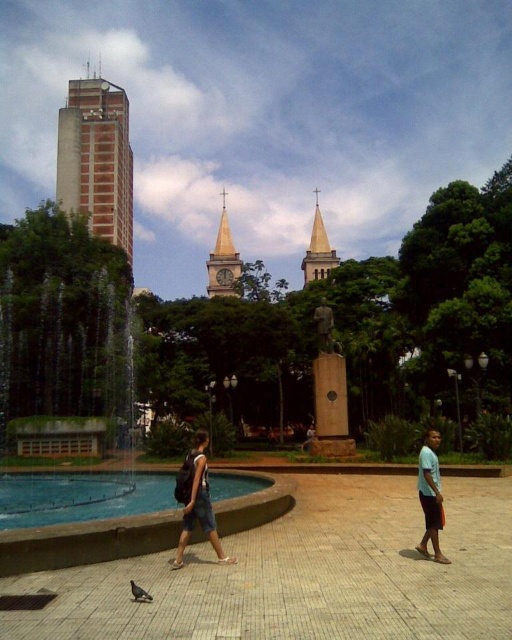
Which of these two, smooth stone clock tower at center or smooth stone spire at center, stands shorter?

Standing shorter between the two is smooth stone spire at center.

Between smooth stone clock tower at center and smooth stone spire at center, which one is positioned lower?

smooth stone spire at center

Who is more distant from viewer, (233, 250) or (309, 275)?

The point (233, 250) is behind.

What are the coordinates of `smooth stone clock tower at center` in the screenshot? It's located at (223, 259).

Between concrete tower at left and smooth stone spire at center, which one has more height?

concrete tower at left

Who is positioned more to the right, concrete tower at left or smooth stone spire at center?

From the viewer's perspective, smooth stone spire at center appears more on the right side.

I want to click on concrete tower at left, so click(x=96, y=160).

The height and width of the screenshot is (640, 512). What are the coordinates of `concrete tower at left` in the screenshot? It's located at (96, 160).

Who is positioned more to the right, smooth stone clock tower at center or gray matte pigeon at lower left?

gray matte pigeon at lower left

Is point (222, 220) in front of point (140, 589)?

No, it is not.

Between point (209, 262) and point (143, 595), which one is positioned behind?

The point (209, 262) is more distant.

Find the location of a particular element. smooth stone clock tower at center is located at coordinates (223, 259).